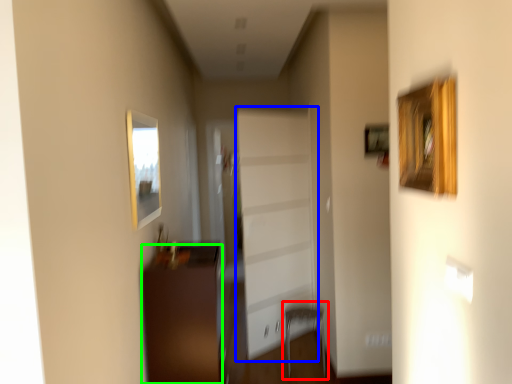
Question: Which object is the farthest from armchair (highlighted by a red box)? Choose among these: garage door (highlighted by a blue box) or furniture (highlighted by a green box).

Choices:
 (A) garage door
 (B) furniture

Answer: (B)